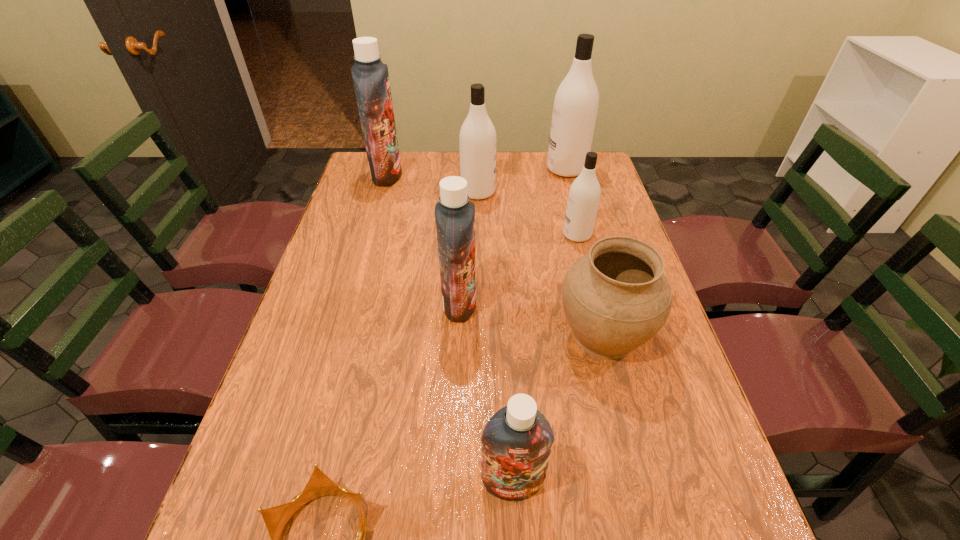
I want to click on free space located on the front-facing side of the smallest white shampoo, so [464, 235].

Find the location of a particular element. vacant position located 0.060m on the front label of the rightmost blue shampoo is located at coordinates (516, 539).

You are a GUI agent. You are given a task and a screenshot of the screen. Output one action in this format:
    pyautogui.click(x=<x>, y=<y>)
    Task: Click on the blank space located on the front of the urn
    The width and height of the screenshot is (960, 540).
    Given the screenshot: What is the action you would take?
    pyautogui.click(x=644, y=491)

You are a GUI agent. You are given a task and a screenshot of the screen. Output one action in this format:
    pyautogui.click(x=<x>, y=<y>)
    Task: Click on the object that is positioned at the left edge
    This screenshot has height=540, width=960.
    Given the screenshot: What is the action you would take?
    370,75

Image resolution: width=960 pixels, height=540 pixels. In order to click on urn that is positioned at the right edge in this screenshot , I will do `click(616, 298)`.

At what (x,y) coordinates should I click in order to perform the action: click on object present at the far left corner. Please return your answer as a coordinate pair (x, y). The height and width of the screenshot is (540, 960). Looking at the image, I should click on (370, 75).

In order to click on object positioned at the far right corner in this screenshot , I will do `click(576, 101)`.

I want to click on vacant space at the far edge of the desktop, so click(521, 178).

Identify the location of vacant region at the left edge of the desktop. The height and width of the screenshot is (540, 960). (310, 343).

Locate an element on the screen. The width and height of the screenshot is (960, 540). vacant space at the right edge of the desktop is located at coordinates (622, 222).